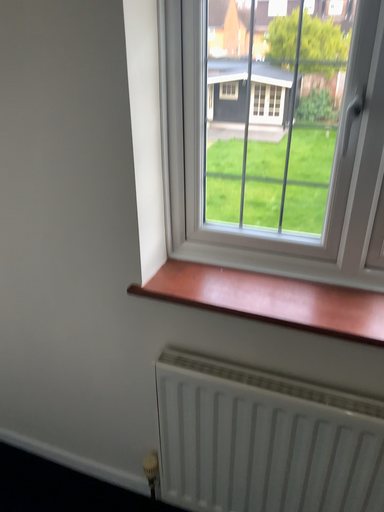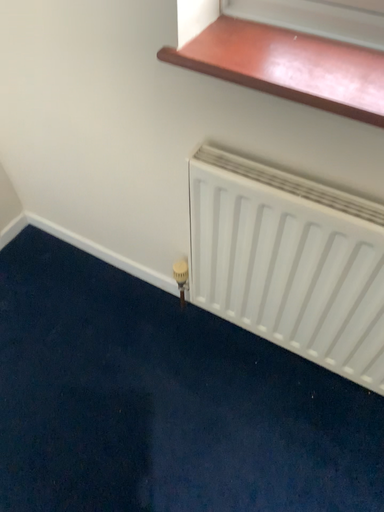
Question: Which way did the camera rotate in the video?

Choices:
 (A) rotated right
 (B) rotated left

Answer: (B)